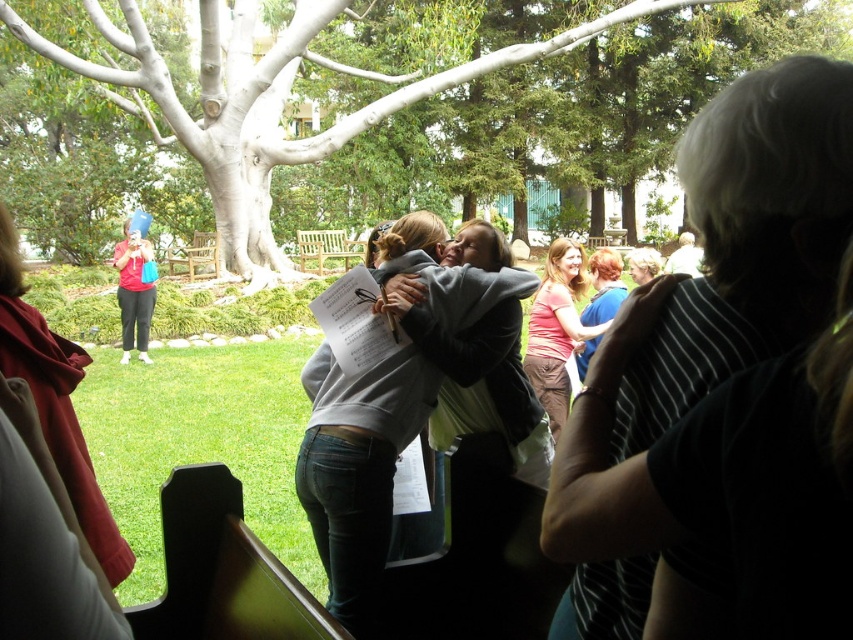
Question: Which of the following is the closest to the observer?

Choices:
 (A) matte red shirt at left
 (B) white textured tree at center
 (C) pink fabric shirt at center

Answer: (C)

Question: Does pink fabric shirt at center have a lesser width compared to matte red shirt at left?

Choices:
 (A) yes
 (B) no

Answer: (A)

Question: Which point is farther to the camera?

Choices:
 (A) (380, 435)
 (B) (310, 136)
 (C) (556, 340)

Answer: (B)

Question: Does white textured tree at center appear on the left side of gray sweatshirt at center?

Choices:
 (A) yes
 (B) no

Answer: (B)

Question: Can you confirm if white textured tree at center is thinner than pink fabric shirt at center?

Choices:
 (A) no
 (B) yes

Answer: (A)

Question: Considering the real-world distances, which object is farthest from the matte red shirt at left?

Choices:
 (A) pink fabric shirt at center
 (B) gray sweatshirt at center

Answer: (B)